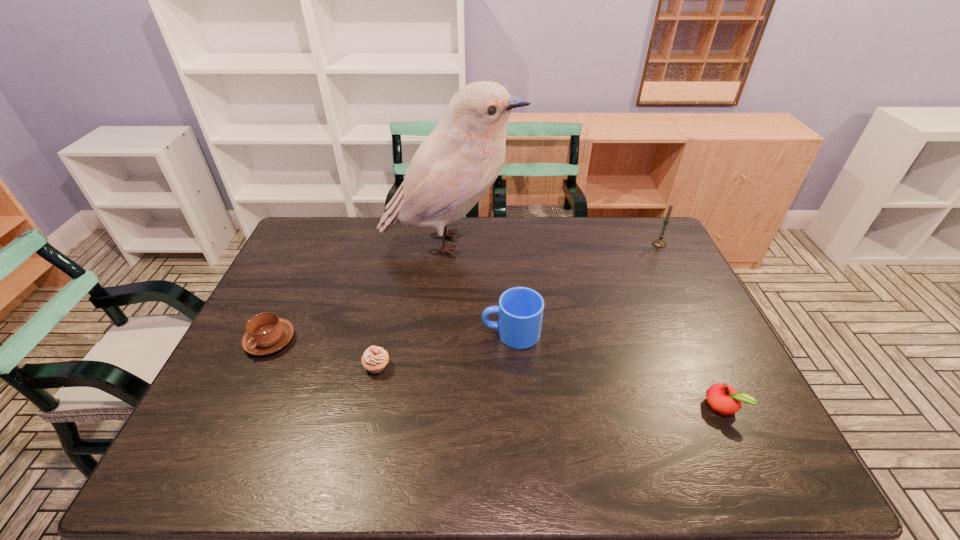
The width and height of the screenshot is (960, 540). In the image, there is a desktop. In order to click on vacant space at the far edge in this screenshot , I will do `click(350, 254)`.

In the image, there is a desktop. Where is `vacant space at the near edge`? The height and width of the screenshot is (540, 960). vacant space at the near edge is located at coordinates point(260,451).

You are a GUI agent. You are given a task and a screenshot of the screen. Output one action in this format:
    pyautogui.click(x=<x>, y=<y>)
    Task: Click on the free space at the left edge of the desktop
    Image resolution: width=960 pixels, height=540 pixels.
    Given the screenshot: What is the action you would take?
    pyautogui.click(x=237, y=373)

Image resolution: width=960 pixels, height=540 pixels. In the image, there is a desktop. What are the coordinates of `free space at the right edge` in the screenshot? It's located at click(x=707, y=407).

Where is `vacant space at the far left corner of the desktop`? Image resolution: width=960 pixels, height=540 pixels. vacant space at the far left corner of the desktop is located at coordinates (306, 221).

Locate an element on the screen. The image size is (960, 540). vacant space at the far right corner is located at coordinates (628, 220).

Locate an element on the screen. The height and width of the screenshot is (540, 960). free region at the near right corner of the desktop is located at coordinates (744, 471).

I want to click on vacant point located between the parakeet and the apple, so click(587, 325).

Locate an element on the screen. unoccupied area between the cupcake and the apple is located at coordinates (549, 386).

Where is `vacant area between the mug and the cappuccino`? The image size is (960, 540). vacant area between the mug and the cappuccino is located at coordinates click(x=391, y=337).